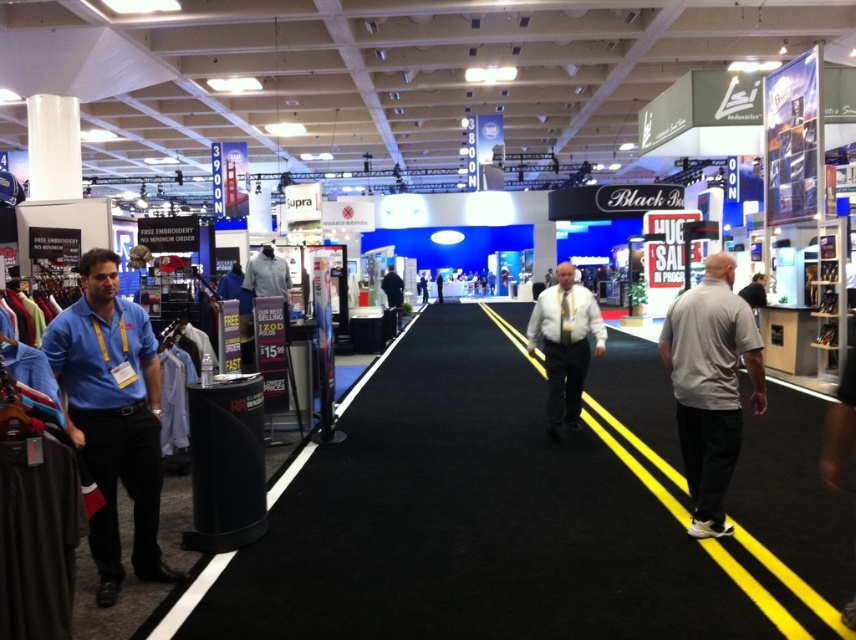
Question: Is blue cotton shirt at left below gray fabric polo shirt at center?

Choices:
 (A) yes
 (B) no

Answer: (A)

Question: Which object is the closest to the blue cotton shirt at left?

Choices:
 (A) gray matte shirt at right
 (B) white shirt at center
 (C) gray fabric polo shirt at center

Answer: (A)

Question: Which of these objects is positioned closest to the gray matte shirt at right?

Choices:
 (A) blue cotton shirt at left
 (B) gray fabric polo shirt at center

Answer: (A)

Question: Is blue cotton shirt at left further to camera compared to white shirt at center?

Choices:
 (A) no
 (B) yes

Answer: (A)

Question: Estimate the real-world distances between objects in this image. Which object is closer to the blue cotton shirt at left?

Choices:
 (A) white shirt at center
 (B) gray matte shirt at right

Answer: (B)

Question: Is blue cotton shirt at left positioned before gray matte shirt at right?

Choices:
 (A) yes
 (B) no

Answer: (A)